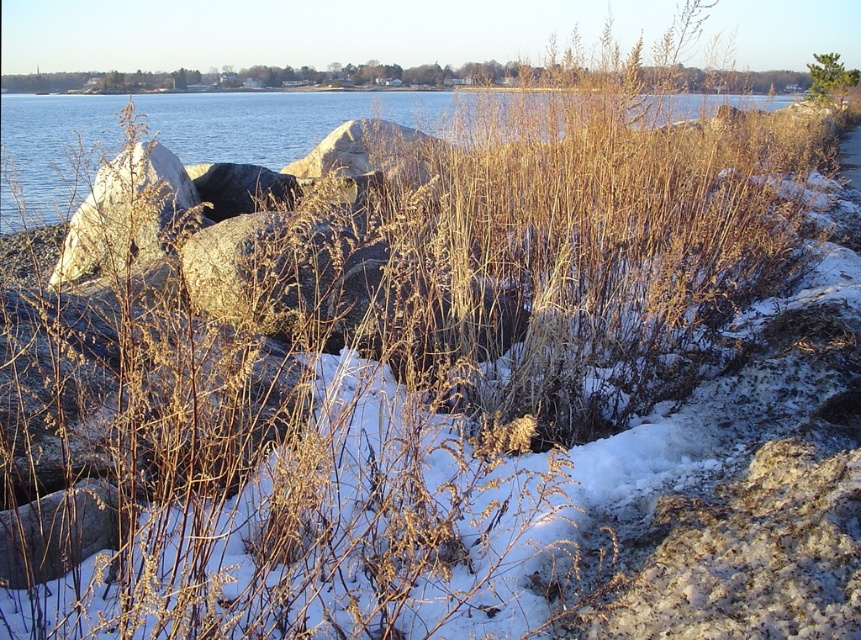
Question: Can you confirm if blue water at upper center is positioned to the right of green leafy tree at upper right?

Choices:
 (A) no
 (B) yes

Answer: (A)

Question: Among these points, which one is nearest to the camera?

Choices:
 (A) (259, 97)
 (B) (835, 84)

Answer: (A)

Question: Is blue water at upper center above green leafy tree at upper right?

Choices:
 (A) no
 (B) yes

Answer: (A)

Question: Which object appears farthest from the camera in this image?

Choices:
 (A) green leafy tree at upper right
 (B) blue water at upper center

Answer: (A)

Question: Which object appears closest to the camera in this image?

Choices:
 (A) green leafy tree at upper right
 (B) blue water at upper center

Answer: (B)

Question: Does blue water at upper center have a larger size compared to green leafy tree at upper right?

Choices:
 (A) yes
 (B) no

Answer: (A)